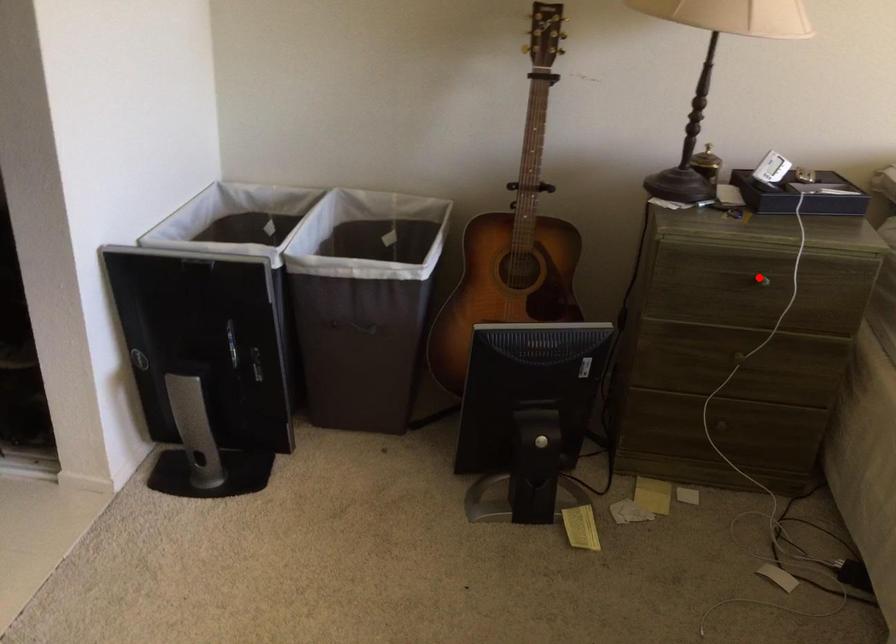
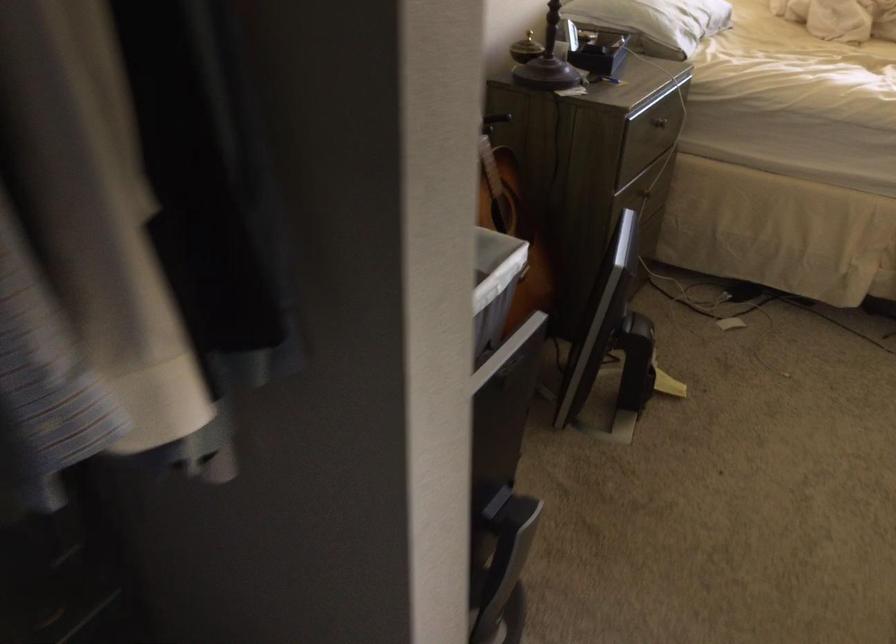
The point at the highlighted location is marked in the first image. Where is the corresponding point in the second image?

(659, 122)